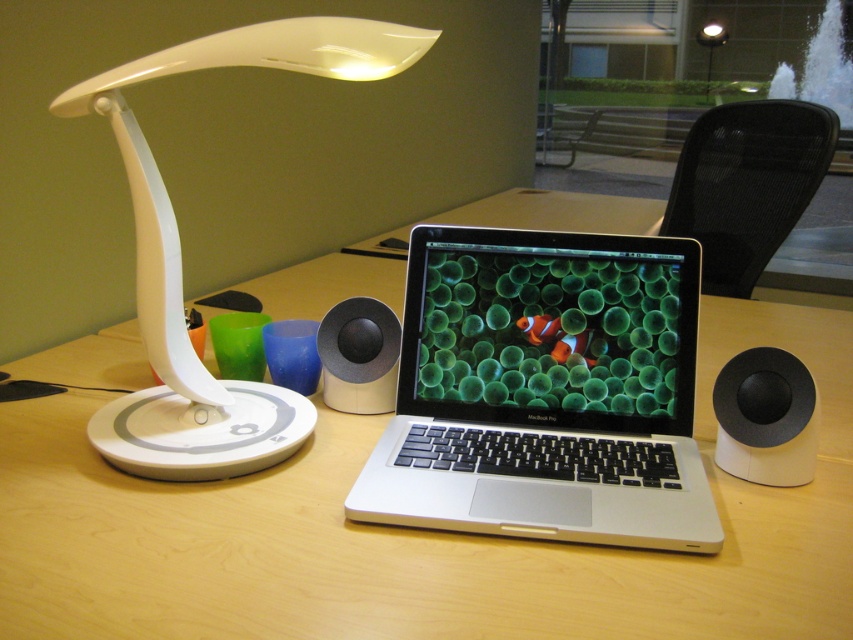
Based on the photo, is silver/black laptop at center to the right of white plastic table lamp at upper center from the viewer's perspective?

No, silver/black laptop at center is not to the right of white plastic table lamp at upper center.

Where is `silver/black laptop at center`? The height and width of the screenshot is (640, 853). silver/black laptop at center is located at coordinates (544, 392).

Which is below, silver/black laptop at center or orange matte clown fish at center?

Positioned lower is silver/black laptop at center.

Measure the distance between silver/black laptop at center and orange matte clown fish at center.

The distance of silver/black laptop at center from orange matte clown fish at center is 5.89 inches.

Measure the distance between point (x=607, y=500) and camera.

Point (x=607, y=500) is 35.05 inches from camera.

Find the location of `silver/black laptop at center`. silver/black laptop at center is located at coordinates (544, 392).

Between white glossy table lamp at left and black mesh chair at upper right, which one appears on the right side from the viewer's perspective?

black mesh chair at upper right

Describe the element at coordinates (180, 257) in the screenshot. I see `white glossy table lamp at left` at that location.

Locate an element on the screen. This screenshot has width=853, height=640. white glossy table lamp at left is located at coordinates [180, 257].

The image size is (853, 640). I want to click on white glossy table lamp at left, so click(180, 257).